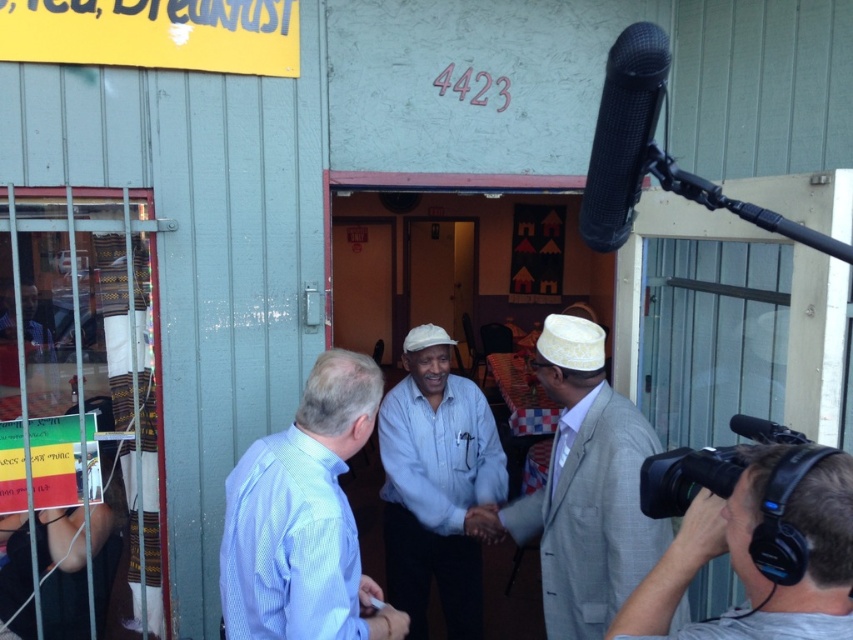
You are standing outside the building and want to enter the entrance. There is a point at center marked by coordinates point (436, 484). Is the entrance to the building located to the left or right of this point?

The entrance to the building is located to the left of the point 0.759, 0.52.

You are standing at the entrance of the building and see both the light blue shirt at center and the white textured suit at center. From your perspective, which one is positioned to the left?

The light blue shirt at center is to the left of the white textured suit at center, so the light blue shirt at center is positioned to the left.